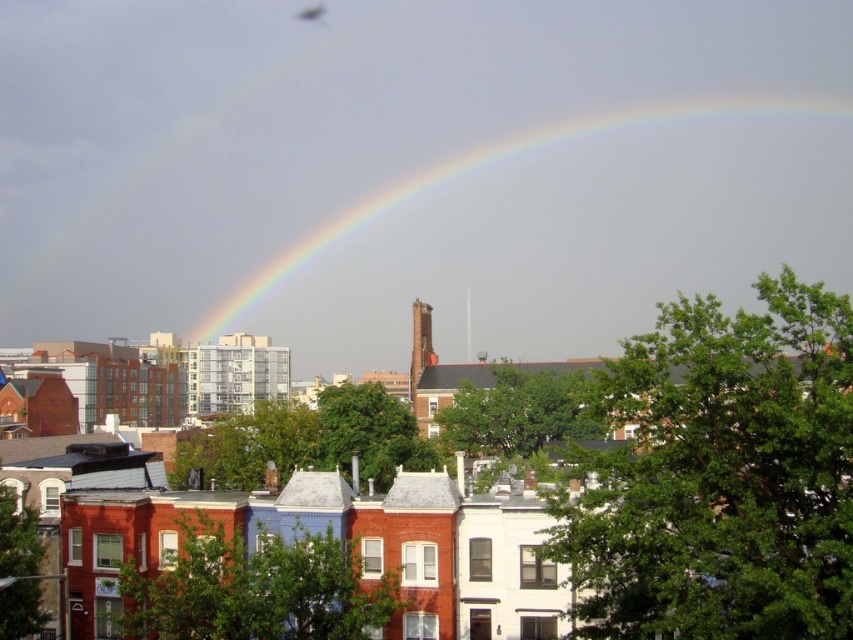
You are an artist trying to capture the scene. You notice the rainbow at upper center and the translucent glass fly at upper center. Which object is positioned more to the right?

The rainbow at upper center is positioned more to the right than the translucent glass fly at upper center.

You are standing in the urban landscape scene and want to place a small decorative flag at one of the two points indicated by the coordinates point [364,204] and point [323,10]. Which point is closer to you where you can easily place the flag without needing to move too far?

Point [364,204] is closer to the viewer than point [323,10], so you can easily place the flag there without needing to move too far.